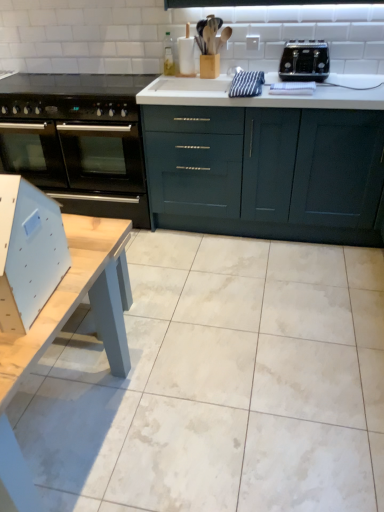
Question: Considering the relative positions of black glass oven at left and black plastic toaster at upper right in the image provided, is black glass oven at left to the right of black plastic toaster at upper right from the viewer's perspective?

Choices:
 (A) no
 (B) yes

Answer: (A)

Question: Does black glass oven at left turn towards black plastic toaster at upper right?

Choices:
 (A) yes
 (B) no

Answer: (B)

Question: From the image's perspective, is black glass oven at left beneath black plastic toaster at upper right?

Choices:
 (A) yes
 (B) no

Answer: (A)

Question: Does black glass oven at left appear on the left side of black plastic toaster at upper right?

Choices:
 (A) no
 (B) yes

Answer: (B)

Question: Is black glass oven at left positioned far away from black plastic toaster at upper right?

Choices:
 (A) no
 (B) yes

Answer: (B)

Question: Considering the relative positions of light blue plastic chair at lower left and black glass oven at left in the image provided, is light blue plastic chair at lower left to the left or to the right of black glass oven at left?

Choices:
 (A) left
 (B) right

Answer: (B)

Question: From a real-world perspective, relative to black glass oven at left, is light blue plastic chair at lower left vertically above or below?

Choices:
 (A) below
 (B) above

Answer: (B)

Question: In terms of height, does light blue plastic chair at lower left look taller or shorter compared to black glass oven at left?

Choices:
 (A) tall
 (B) short

Answer: (B)

Question: In terms of width, does light blue plastic chair at lower left look wider or thinner when compared to black glass oven at left?

Choices:
 (A) thin
 (B) wide

Answer: (A)

Question: From their relative heights in the image, would you say matte dark blue cabinets at center is taller or shorter than black plastic toaster at upper right?

Choices:
 (A) tall
 (B) short

Answer: (A)

Question: Choose the correct answer: Is matte dark blue cabinets at center inside black plastic toaster at upper right or outside it?

Choices:
 (A) outside
 (B) inside

Answer: (A)

Question: From the image's perspective, is matte dark blue cabinets at center located above or below black plastic toaster at upper right?

Choices:
 (A) below
 (B) above

Answer: (A)

Question: In the image, is matte dark blue cabinets at center positioned in front of or behind black plastic toaster at upper right?

Choices:
 (A) front
 (B) behind

Answer: (A)

Question: From the image's perspective, is light wood table at lower left above or below light blue plastic chair at lower left?

Choices:
 (A) above
 (B) below

Answer: (B)

Question: Is light wood table at lower left in front of or behind light blue plastic chair at lower left in the image?

Choices:
 (A) front
 (B) behind

Answer: (A)